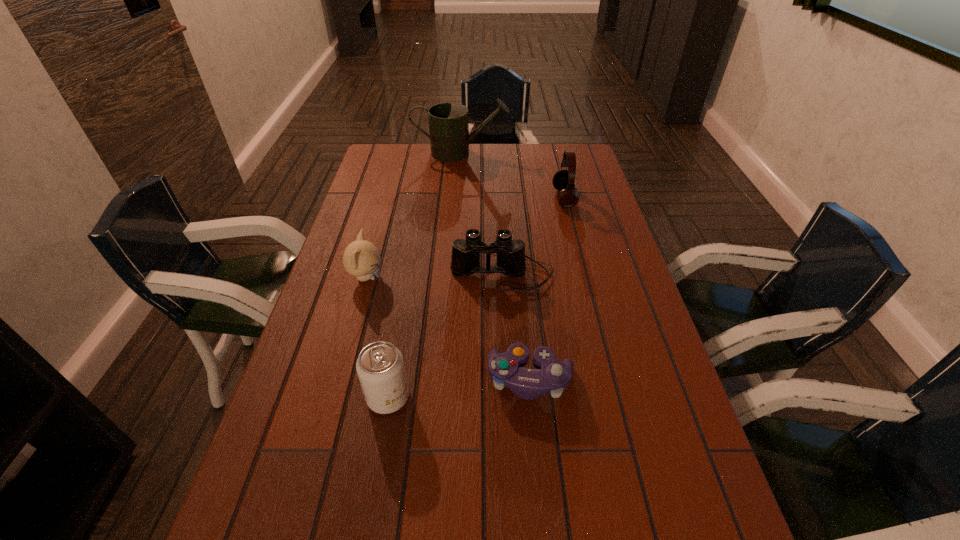
You are a GUI agent. You are given a task and a screenshot of the screen. Output one action in this format:
    pyautogui.click(x=<x>, y=<y>)
    Task: Click on the vacant space situated 0.150m on the ear pads of the headset
    This screenshot has height=540, width=960.
    Given the screenshot: What is the action you would take?
    pyautogui.click(x=510, y=198)

At what (x,y) coordinates should I click in order to perform the action: click on vacant space located 0.390m on the ear pads of the headset. Please return your answer as a coordinate pair (x, y). This screenshot has width=960, height=540. Looking at the image, I should click on (440, 198).

At what (x,y) coordinates should I click in order to perform the action: click on vacant space located 0.170m on the front of the soda can. Please return your answer as a coordinate pair (x, y). Looking at the image, I should click on (370, 503).

Identify the location of vacant area situated on the right of the binoculars. (575, 274).

Where is `free point located on the face of the kitten`? This screenshot has width=960, height=540. free point located on the face of the kitten is located at coordinates click(x=448, y=278).

The width and height of the screenshot is (960, 540). Find the location of `vacant space situated on the left of the shortest object`. vacant space situated on the left of the shortest object is located at coordinates (420, 380).

This screenshot has height=540, width=960. Identify the location of object located in the far edge section of the desktop. (449, 136).

Find the location of a particular element. This screenshot has height=540, width=960. watering can located at the left edge is located at coordinates (449, 136).

Locate an element on the screen. kitten that is positioned at the left edge is located at coordinates (361, 258).

You are a GUI agent. You are given a task and a screenshot of the screen. Output one action in this format:
    pyautogui.click(x=<x>, y=<y>)
    Task: Click on the object situated at the right edge
    The image size is (960, 540).
    Given the screenshot: What is the action you would take?
    pyautogui.click(x=568, y=196)